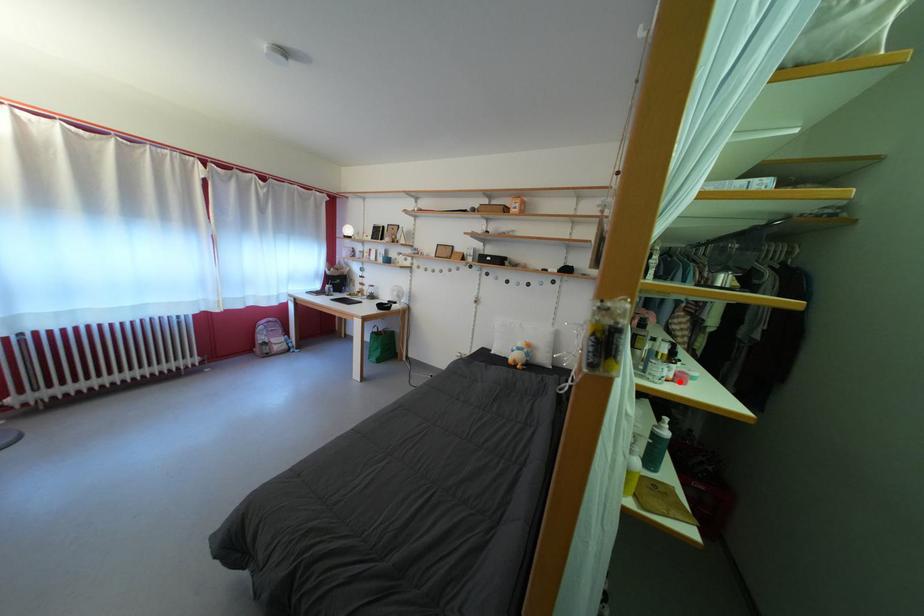
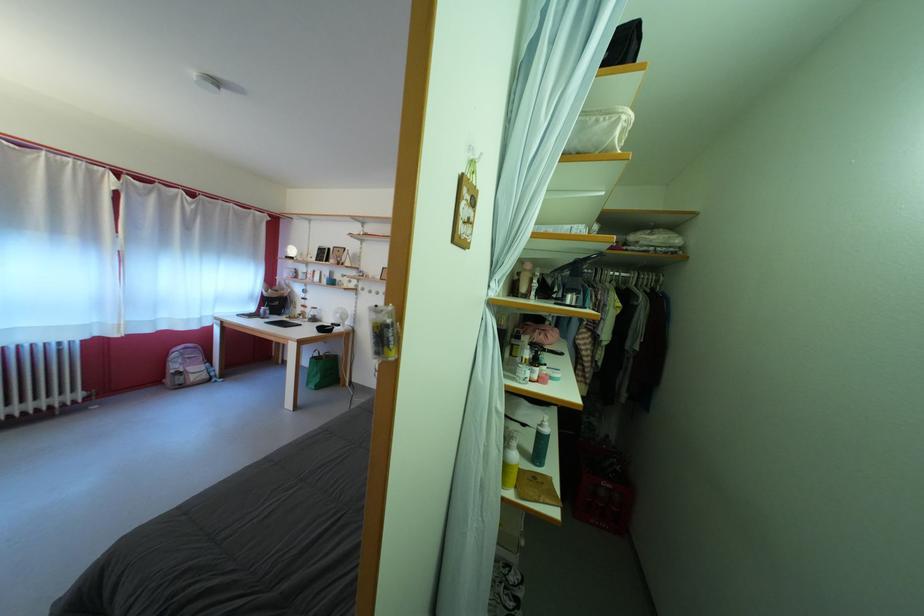
Find the pixel in the second image that matches the highlighted location in the first image.

(543, 383)